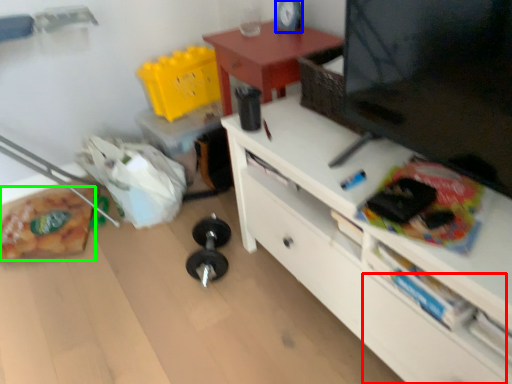
Question: Considering the real-world distances, which object is farthest from drawer (highlighted by a red box)? clock (highlighted by a blue box) or stuff (highlighted by a green box)?

Choices:
 (A) clock
 (B) stuff

Answer: (B)